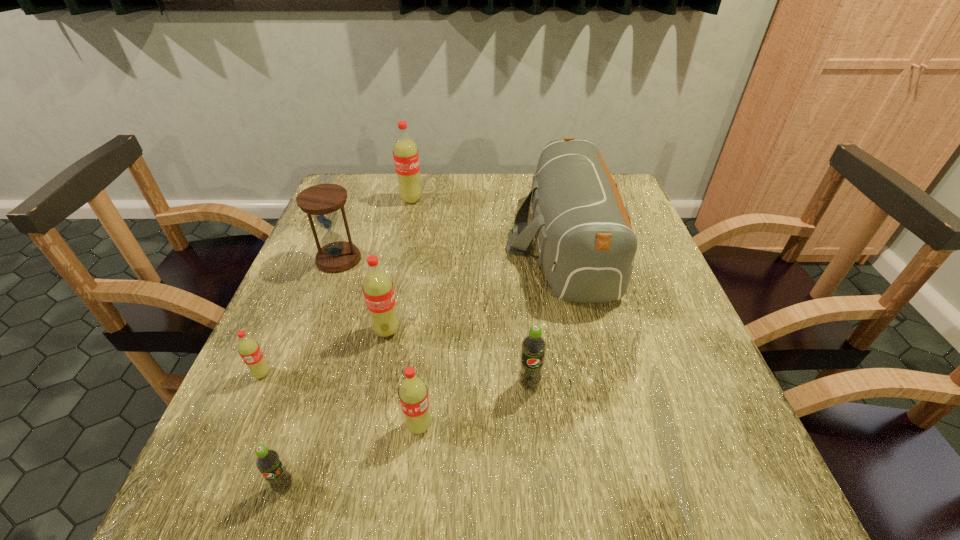
Identify the location of the biggest red soda. The image size is (960, 540). (405, 152).

At what (x,y) coordinates should I click in order to perform the action: click on the tallest soda. Please return your answer as a coordinate pair (x, y). Looking at the image, I should click on click(x=405, y=152).

Locate an element on the screen. This screenshot has width=960, height=540. duffel bag is located at coordinates (586, 244).

This screenshot has width=960, height=540. I want to click on the fifth nearest object, so click(x=378, y=290).

At what (x,y) coordinates should I click in order to perform the action: click on the second tallest soda. Please return your answer as a coordinate pair (x, y). Looking at the image, I should click on (378, 290).

The height and width of the screenshot is (540, 960). Find the location of `hourglass`. hourglass is located at coordinates tap(322, 201).

I want to click on the right green soda, so click(533, 345).

The height and width of the screenshot is (540, 960). Find the location of `the bigger green soda`. the bigger green soda is located at coordinates (533, 345).

At what (x,y) coordinates should I click in order to perform the action: click on the seventh farthest object. Please return your answer as a coordinate pair (x, y). This screenshot has height=540, width=960. Looking at the image, I should click on (413, 394).

The height and width of the screenshot is (540, 960). I want to click on the third object from right to left, so click(413, 394).